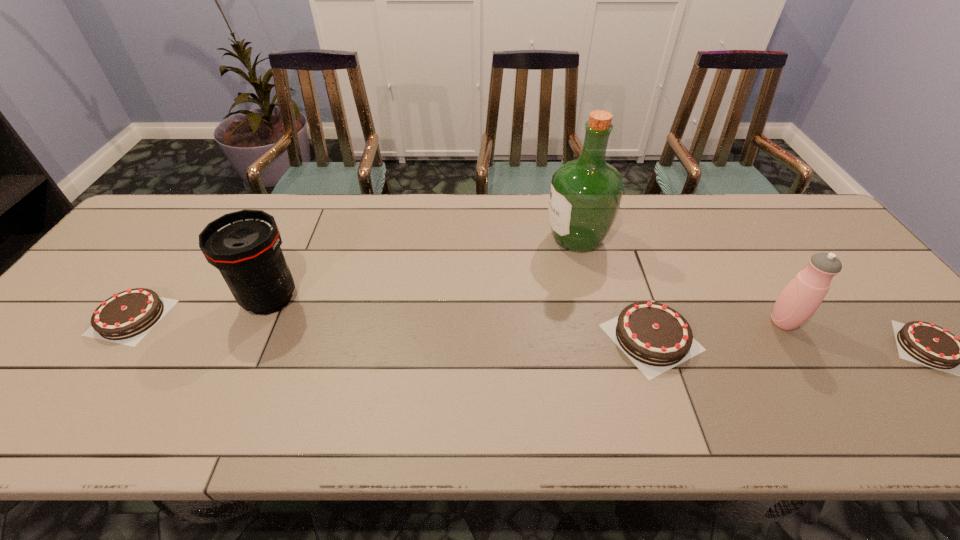
Locate an element on the screen. The height and width of the screenshot is (540, 960). free space located 0.060m on the front-facing side of the tallest object is located at coordinates (524, 239).

Where is `free location located 0.160m on the front-facing side of the tallest object`? The image size is (960, 540). free location located 0.160m on the front-facing side of the tallest object is located at coordinates [491, 239].

The image size is (960, 540). I want to click on vacant space situated on the back of the second object from left to right, so click(x=316, y=198).

This screenshot has height=540, width=960. What are the coordinates of `vacant space located 0.180m on the left of the fifth object from left to right` in the screenshot? It's located at (694, 322).

The height and width of the screenshot is (540, 960). Find the location of `object present at the far edge`. object present at the far edge is located at coordinates coord(585,195).

This screenshot has width=960, height=540. Find the location of `object that is at the near edge`. object that is at the near edge is located at coordinates (655, 337).

Find the location of a particular element. The height and width of the screenshot is (540, 960). object located in the left edge section of the desktop is located at coordinates (128, 316).

Where is `free space at the far edge of the desktop`? The image size is (960, 540). free space at the far edge of the desktop is located at coordinates (296, 208).

I want to click on vacant space at the near edge of the desktop, so click(75, 397).

Locate an element on the screen. vacant region at the left edge of the desktop is located at coordinates click(121, 274).